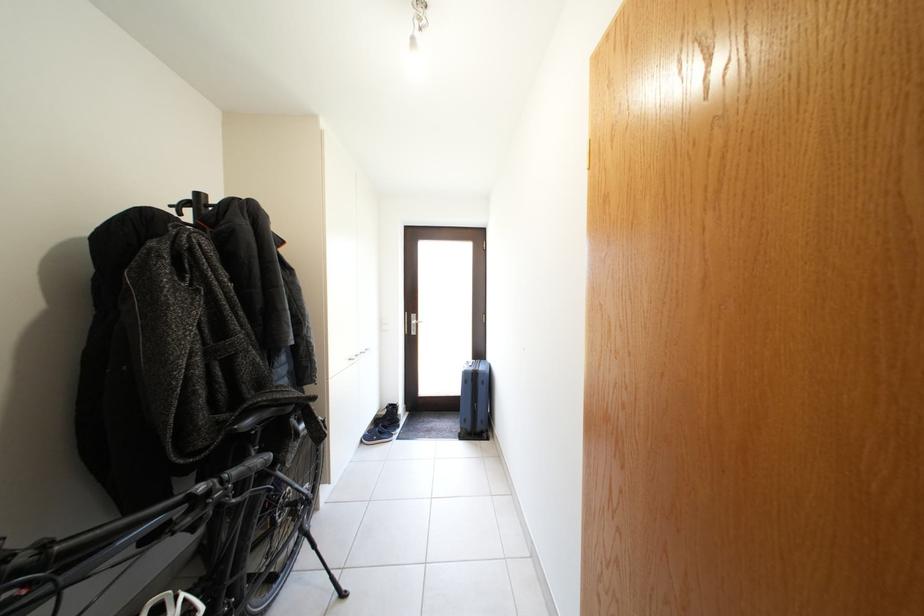
The image size is (924, 616). Describe the element at coordinates (246, 468) in the screenshot. I see `a black bicycle handlebar` at that location.